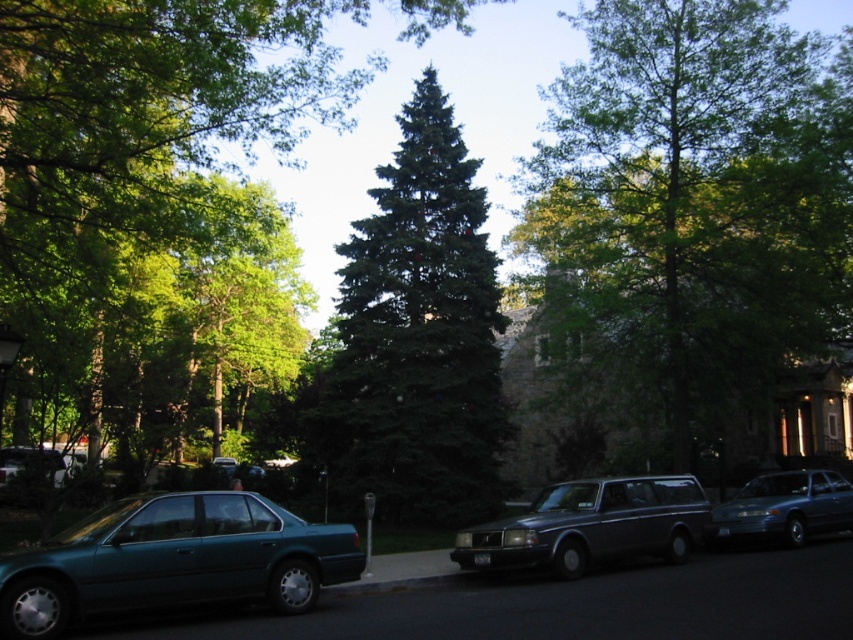
You are a pedestrian standing on the sidewalk and want to cross the street. You see the green textured tree at center and the teal metallic sedan at lower left. Which object is higher from the ground?

The green textured tree at center is above the teal metallic sedan at lower left, so the green textured tree at center is higher from the ground.

You are standing at the point marked as point (173, 561) in the image. What vehicle is directly in front of you?

Result: The teal metallic sedan at lower left is directly in front of you at point (173, 561).

You are standing at the point with coordinates 0.7, 0.7. You want to walk to the metallic gray station wagon at center. In which direction should you walk?

The metallic gray station wagon at center is located at point [590,525]. Since you are at [596,448], you should walk northeast to reach it.